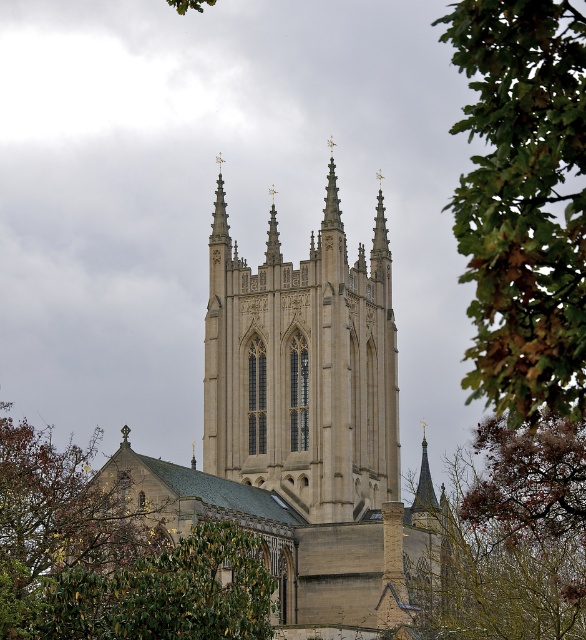
Question: Which point is farther from the camera taking this photo?

Choices:
 (A) (226, 608)
 (B) (481, 28)
 (C) (390, 452)
 (D) (220, 272)

Answer: (C)

Question: Is beige stone church at center wider than green leafy tree at lower left?

Choices:
 (A) yes
 (B) no

Answer: (B)

Question: Estimate the real-world distances between objects in this image. Which object is farther from the beige stone tower at center?

Choices:
 (A) green leafy tree at upper right
 (B) green leafy tree at lower left
 (C) beige stone church at center
 (D) brown textured leaves at lower right

Answer: (A)

Question: Is beige stone church at center to the right of green leafy tree at upper right from the viewer's perspective?

Choices:
 (A) no
 (B) yes

Answer: (A)

Question: Among these objects, which one is farthest from the camera?

Choices:
 (A) beige stone tower at center
 (B) green leafy tree at lower left
 (C) beige stone church at center
 (D) brown textured leaves at lower right

Answer: (A)

Question: Is green leafy tree at upper right smaller than brown textured leaves at lower right?

Choices:
 (A) no
 (B) yes

Answer: (A)